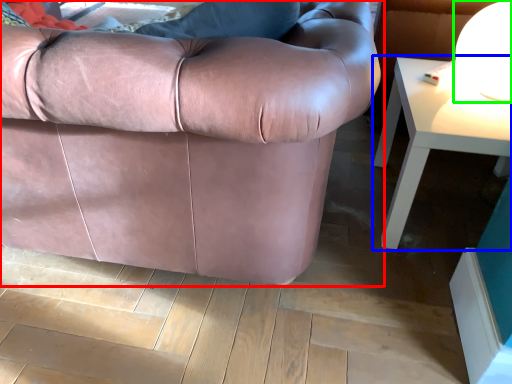
Question: Estimate the real-world distances between objects in this image. Which object is closer to studio couch (highlighted by a red box), table (highlighted by a blue box) or table lamp (highlighted by a green box)?

Choices:
 (A) table
 (B) table lamp

Answer: (A)